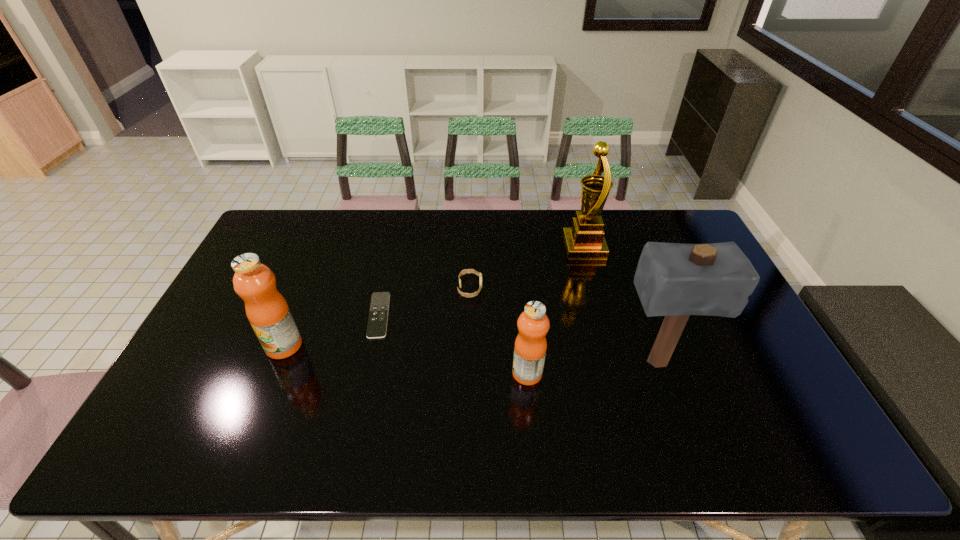
The height and width of the screenshot is (540, 960). I want to click on vacant space at the far edge of the desktop, so click(563, 245).

Find the location of a particular element. This screenshot has height=540, width=960. vacant region at the near edge of the desktop is located at coordinates (377, 405).

Where is `free region at the left edge`? free region at the left edge is located at coordinates (228, 309).

Image resolution: width=960 pixels, height=540 pixels. In the image, there is a desktop. What are the coordinates of `vacant space at the far left corner` in the screenshot? It's located at (x=297, y=223).

You are a GUI agent. You are given a task and a screenshot of the screen. Output one action in this format:
    pyautogui.click(x=<x>, y=<y>)
    Task: Click on the free location at the far right corner
    The height and width of the screenshot is (540, 960).
    Given the screenshot: What is the action you would take?
    pyautogui.click(x=660, y=237)

Where is `free space at the near right corner of the desktop`? Image resolution: width=960 pixels, height=540 pixels. free space at the near right corner of the desktop is located at coordinates (747, 410).

Locate an element on the screen. unoccupied position between the fourth object from right to left and the award is located at coordinates (527, 267).

Where is `unoccupied position between the right fruit juice and the remote control`? The image size is (960, 540). unoccupied position between the right fruit juice and the remote control is located at coordinates (453, 345).

Where is `vacant point located between the watch and the shortest object`? vacant point located between the watch and the shortest object is located at coordinates (424, 302).

Find the location of a particular element. free area in between the award and the leftmost object is located at coordinates (434, 296).